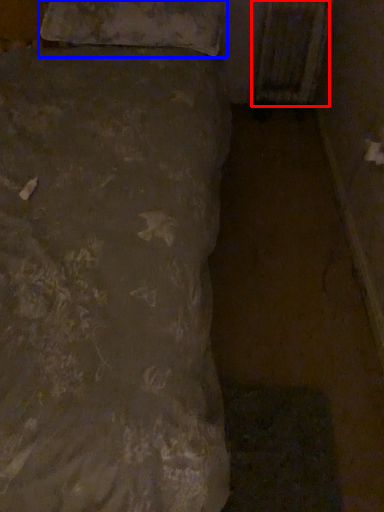
Question: Which object appears farthest to the camera in this image, radiator (highlighted by a red box) or pillow (highlighted by a blue box)?

Choices:
 (A) radiator
 (B) pillow

Answer: (A)